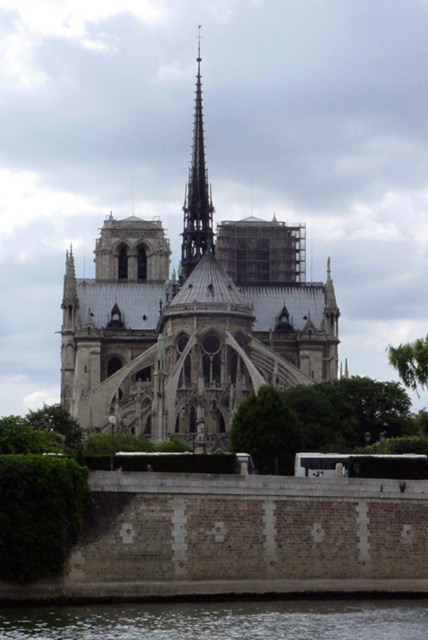
Question: Among these points, which one is farthest from the camera?

Choices:
 (A) (279, 419)
 (B) (199, 257)
 (C) (145, 316)

Answer: (B)

Question: Can you confirm if dark gray water at lower center is positioned to the right of green leafy tree at center?

Choices:
 (A) no
 (B) yes

Answer: (A)

Question: Which point is farther to the camera?

Choices:
 (A) (329, 326)
 (B) (258, 456)
 (C) (240, 614)

Answer: (A)

Question: Can you confirm if stone gothic cathedral at center is smaller than dark gray water at lower center?

Choices:
 (A) yes
 (B) no

Answer: (B)

Question: Which point is farther to the camera?

Choices:
 (A) (184, 243)
 (B) (228, 349)
 (C) (198, 608)

Answer: (A)

Question: Does dark gray water at lower center have a lesser width compared to green leafy tree at center?

Choices:
 (A) no
 (B) yes

Answer: (A)